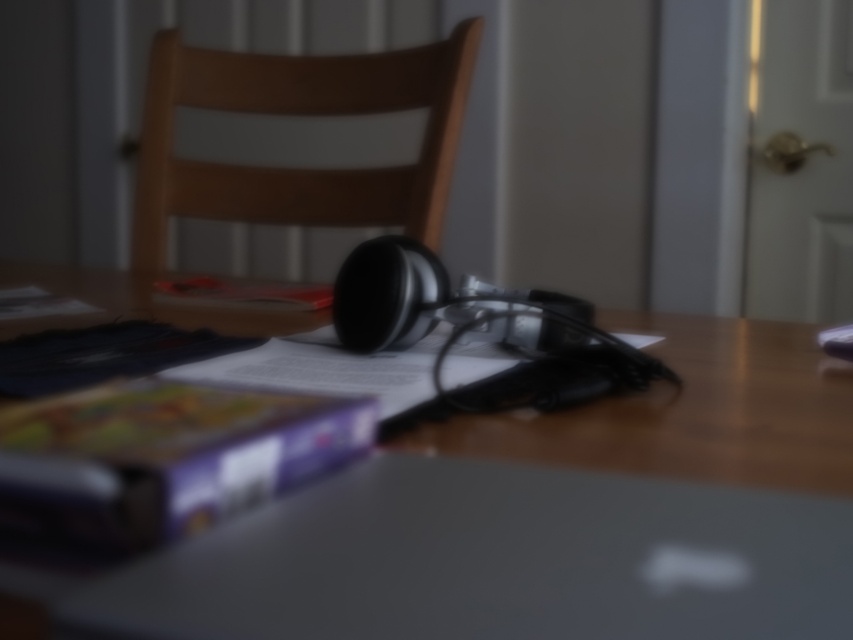
You are a person who is 1.7 meters tall standing in front of the wooden table at center and the wooden chair at center. Which object is taller from your perspective?

The wooden chair at center is taller than the wooden table at center because the wooden table at center is not as tall as the wooden chair at center.

You are organizing a presentation and need to place your laptop in the center of the table. The table has a coordinate system where the bottom left corner is the origin. Given that the point at coordinates (492,561) marks the center of the table, where should you place your laptop?

The point at coordinates (492,561) marks the center of the table, so you should place your laptop there to ensure it is centered.